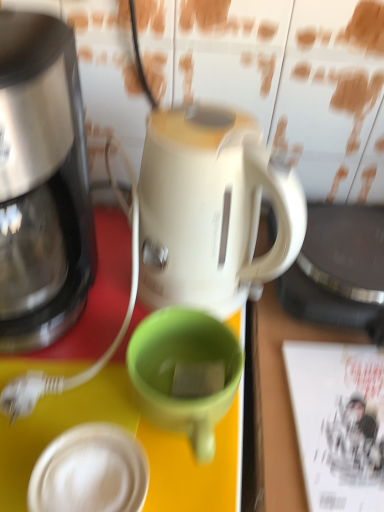
Question: Considering the positions of point (54, 455) and point (337, 416), is point (54, 455) closer or farther from the camera than point (337, 416)?

Choices:
 (A) farther
 (B) closer

Answer: (B)

Question: From the image's perspective, is white matte lid at lower left above or below white paper magazine at right?

Choices:
 (A) below
 (B) above

Answer: (A)

Question: Estimate the real-world distances between objects in this image. Which object is closer to the green matte mug at center?

Choices:
 (A) white matte lid at lower left
 (B) shiny metallic coffee maker at left
 (C) white paper magazine at right

Answer: (A)

Question: Estimate the real-world distances between objects in this image. Which object is farther from the white paper magazine at right?

Choices:
 (A) green matte mug at center
 (B) white matte lid at lower left
 (C) shiny metallic coffee maker at left

Answer: (C)